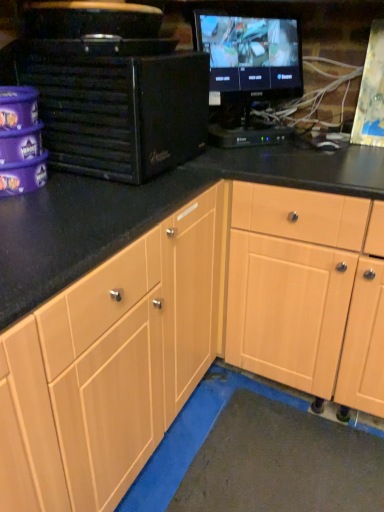
Question: Is black matte desktop computer at left at the back of black glossy monitor at upper right?

Choices:
 (A) yes
 (B) no

Answer: (B)

Question: From the image's perspective, is black glossy monitor at upper right located above black matte desktop computer at left?

Choices:
 (A) no
 (B) yes

Answer: (B)

Question: From a real-world perspective, is black glossy monitor at upper right on top of black matte desktop computer at left?

Choices:
 (A) no
 (B) yes

Answer: (B)

Question: Can you confirm if black glossy monitor at upper right is taller than black matte desktop computer at left?

Choices:
 (A) yes
 (B) no

Answer: (A)

Question: Considering the relative sizes of black glossy monitor at upper right and black matte desktop computer at left in the image provided, is black glossy monitor at upper right shorter than black matte desktop computer at left?

Choices:
 (A) yes
 (B) no

Answer: (B)

Question: Does black glossy monitor at upper right have a smaller size compared to black matte desktop computer at left?

Choices:
 (A) yes
 (B) no

Answer: (A)

Question: Is light wood cabinet at center at the left side of black matte desktop computer at left?

Choices:
 (A) no
 (B) yes

Answer: (A)

Question: Is the position of light wood cabinet at center less distant than that of black matte desktop computer at left?

Choices:
 (A) yes
 (B) no

Answer: (B)

Question: Is black matte desktop computer at left inside light wood cabinet at center?

Choices:
 (A) no
 (B) yes

Answer: (A)

Question: Can you confirm if light wood cabinet at center is wider than black matte desktop computer at left?

Choices:
 (A) no
 (B) yes

Answer: (B)

Question: From the image's perspective, would you say light wood cabinet at center is shown under black matte desktop computer at left?

Choices:
 (A) no
 (B) yes

Answer: (B)

Question: Is light wood cabinet at center not within black matte desktop computer at left?

Choices:
 (A) no
 (B) yes

Answer: (B)

Question: Is black matte desktop computer at left bigger than black glossy monitor at upper right?

Choices:
 (A) no
 (B) yes

Answer: (B)